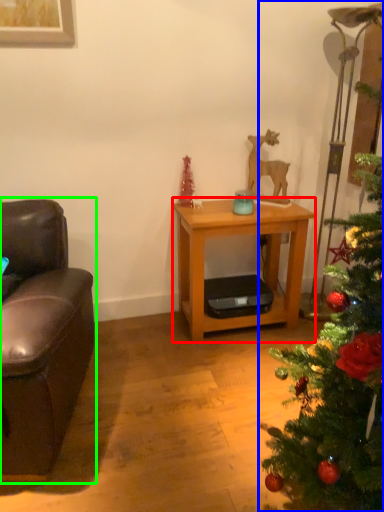
Question: Which object is positioned farthest from desk (highlighted by a red box)? Select from christmas tree (highlighted by a blue box) and studio couch (highlighted by a green box).

Choices:
 (A) christmas tree
 (B) studio couch

Answer: (A)